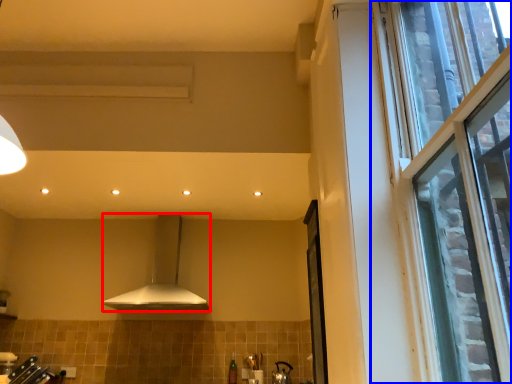
Question: Which object appears closest to the camera in this image, kitchen appliance (highlighted by a red box) or window (highlighted by a blue box)?

Choices:
 (A) kitchen appliance
 (B) window

Answer: (B)